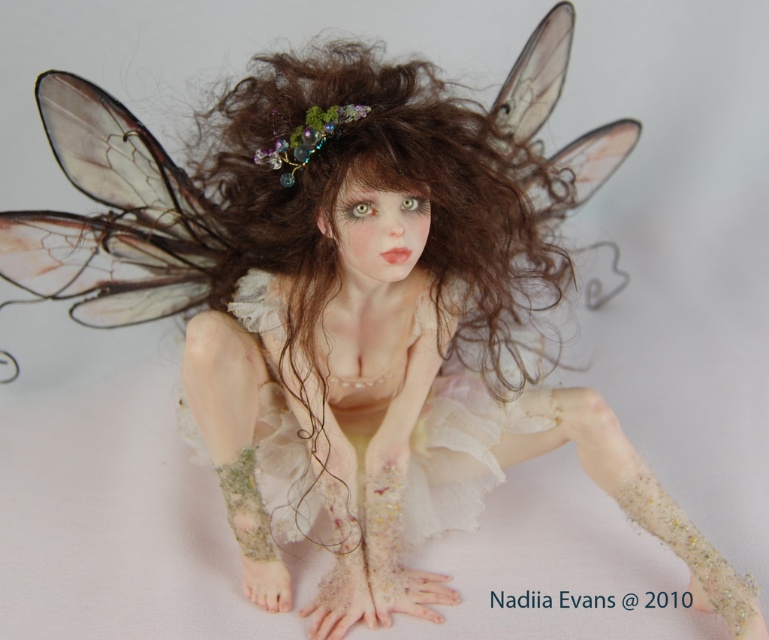
You are a magical creature trying to decide whether to wear the translucent lace dress at center or the translucent gemstone hair ornament at center. Which item takes up more space horizontally?

The translucent lace dress at center is wider than the translucent gemstone hair ornament at center, so it takes up more horizontal space.